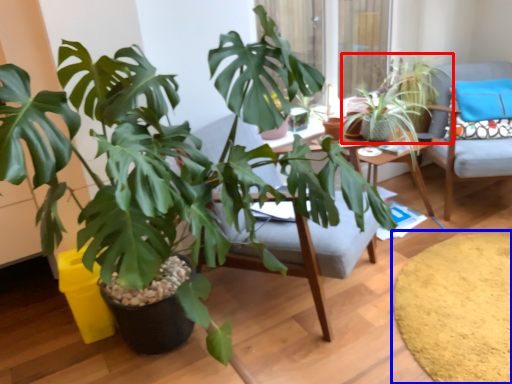
Question: Among these objects, which one is nearest to the camera, houseplant (highlighted by a red box) or mat (highlighted by a blue box)?

Choices:
 (A) houseplant
 (B) mat

Answer: (B)